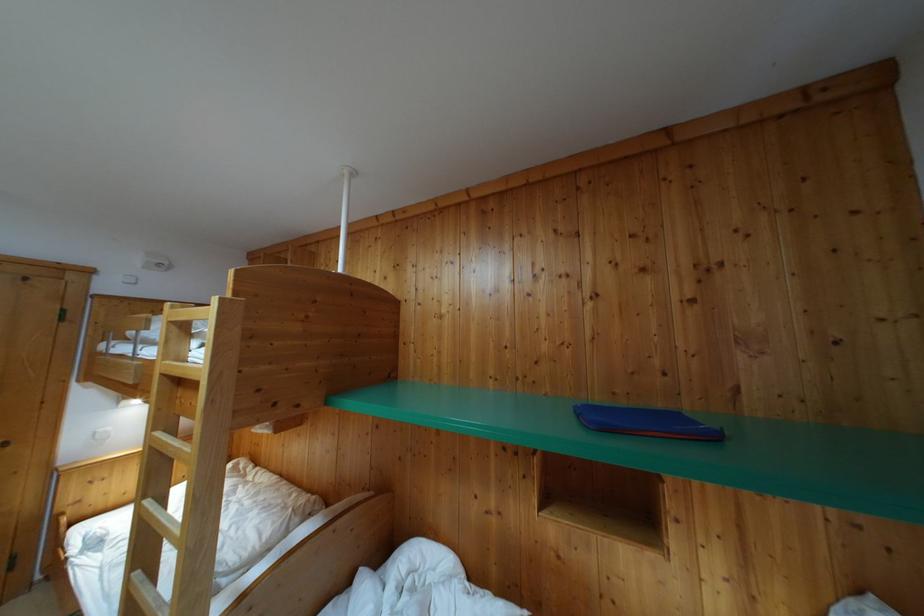
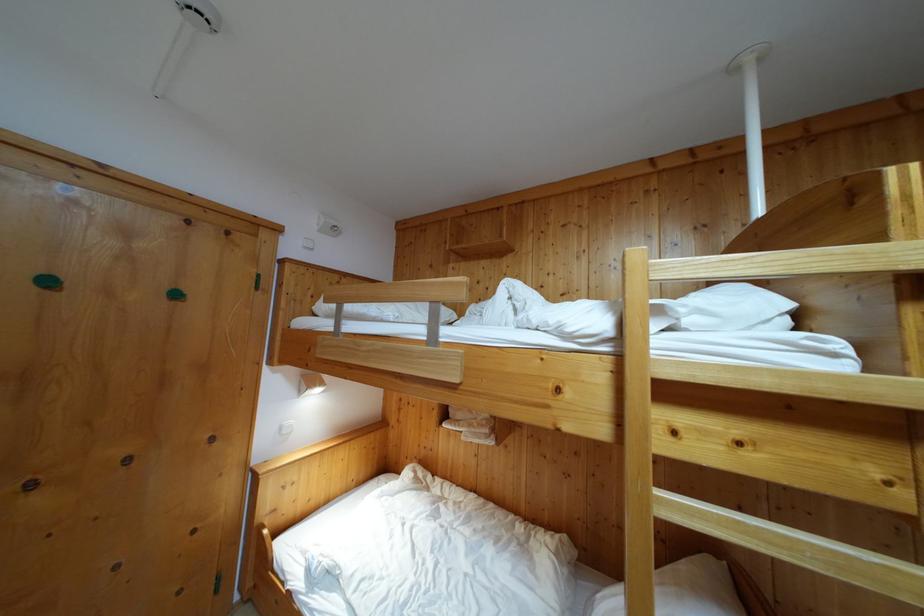
Question: What movement of the cameraman would produce the second image?

Choices:
 (A) Left
 (B) Right
 (C) Forward
 (D) Backward

Answer: (A)